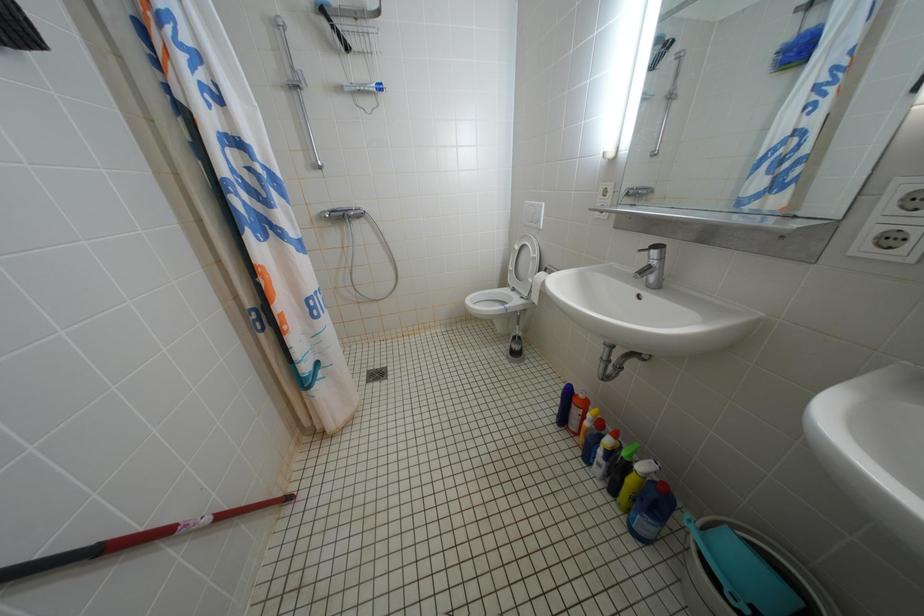
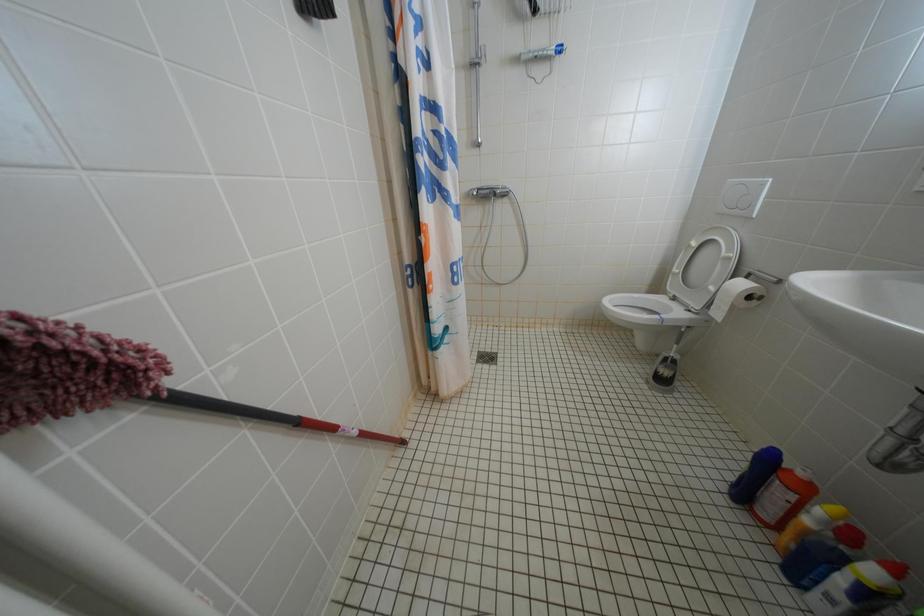
Question: The first image is from the beginning of the video and the second image is from the end. How did the camera likely rotate when shooting the video?

Choices:
 (A) Left
 (B) Right
 (C) Up
 (D) Down

Answer: (A)